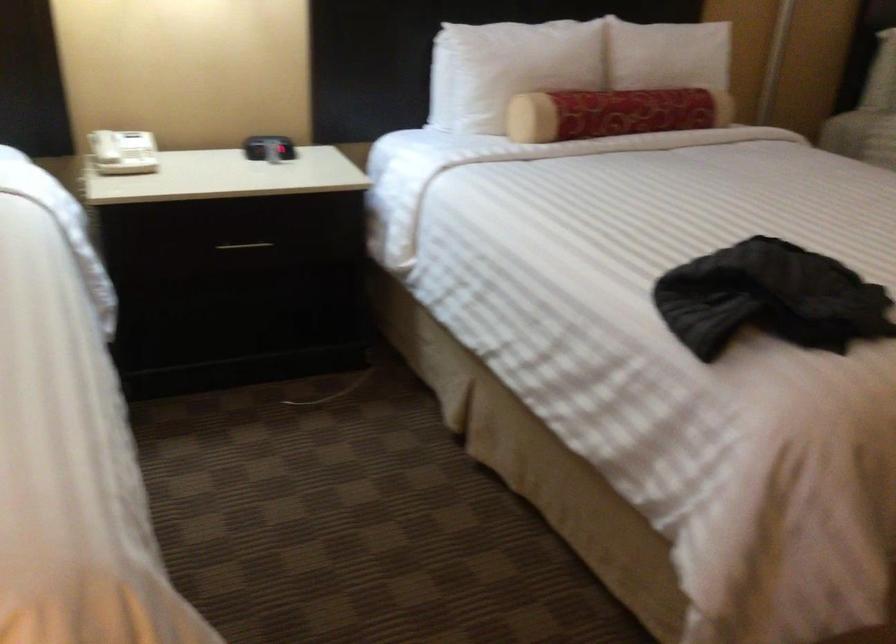
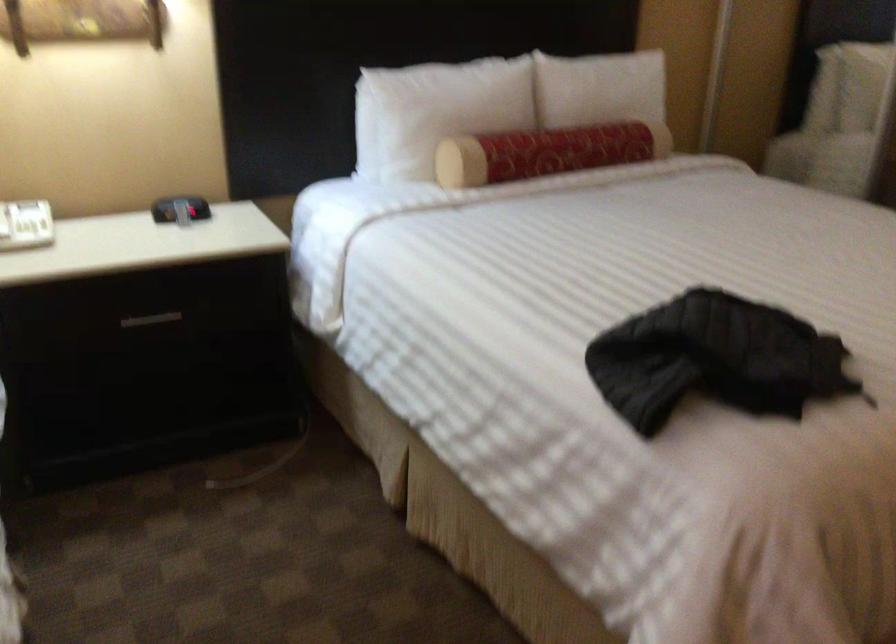
In the second image, find the point that corresponds to (x=615, y=111) in the first image.

(546, 152)